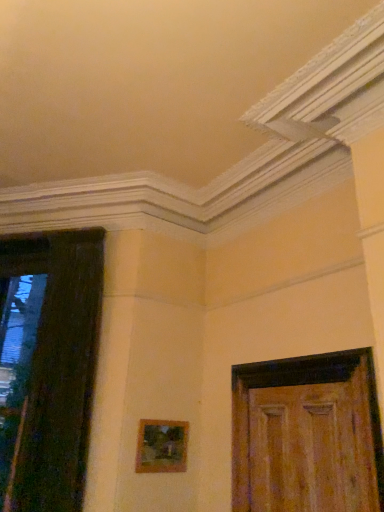
Question: Is wooden frame at center surrounded by wooden door at right, which is the first door from right to left?

Choices:
 (A) yes
 (B) no

Answer: (B)

Question: Is wooden door at right, the second door viewed from the left, positioned far away from wooden frame at center?

Choices:
 (A) no
 (B) yes

Answer: (A)

Question: Is wooden door at right, the second door viewed from the left, positioned before wooden frame at center?

Choices:
 (A) no
 (B) yes

Answer: (B)

Question: Does wooden door at right, the second door viewed from the left, have a lesser width compared to wooden frame at center?

Choices:
 (A) yes
 (B) no

Answer: (B)

Question: From the image's perspective, is wooden door at right, which is the first door from right to left, below wooden frame at center?

Choices:
 (A) yes
 (B) no

Answer: (B)

Question: From their relative heights in the image, would you say wooden door at right, which is the first door from right to left, is taller or shorter than wooden frame at center?

Choices:
 (A) short
 (B) tall

Answer: (B)

Question: From the image's perspective, is wooden door at right, the second door viewed from the left, above or below wooden frame at center?

Choices:
 (A) above
 (B) below

Answer: (A)

Question: Is wooden door at right, which is the first door from right to left, wider or thinner than wooden frame at center?

Choices:
 (A) thin
 (B) wide

Answer: (B)

Question: Is point (281, 508) positioned closer to the camera than point (140, 468)?

Choices:
 (A) closer
 (B) farther

Answer: (A)

Question: From the image's perspective, is wooden frame at center located above or below dark wood door at left, which is counted as the 1th door, starting from the left?

Choices:
 (A) above
 (B) below

Answer: (B)

Question: Considering the positions of wooden frame at center and dark wood door at left, which is counted as the 1th door, starting from the left, in the image, is wooden frame at center wider or thinner than dark wood door at left, which is counted as the 1th door, starting from the left,?

Choices:
 (A) thin
 (B) wide

Answer: (A)

Question: Considering the positions of point (175, 442) and point (33, 369), is point (175, 442) closer or farther from the camera than point (33, 369)?

Choices:
 (A) closer
 (B) farther

Answer: (B)

Question: From a real-world perspective, is wooden frame at center above or below dark wood door at left, acting as the 2th door starting from the right?

Choices:
 (A) above
 (B) below

Answer: (B)

Question: Is wooden door at right, the second door viewed from the left, taller or shorter than dark wood door at left, acting as the 2th door starting from the right?

Choices:
 (A) tall
 (B) short

Answer: (B)

Question: Do you think wooden door at right, the second door viewed from the left, is within dark wood door at left, acting as the 2th door starting from the right, or outside of it?

Choices:
 (A) outside
 (B) inside

Answer: (A)